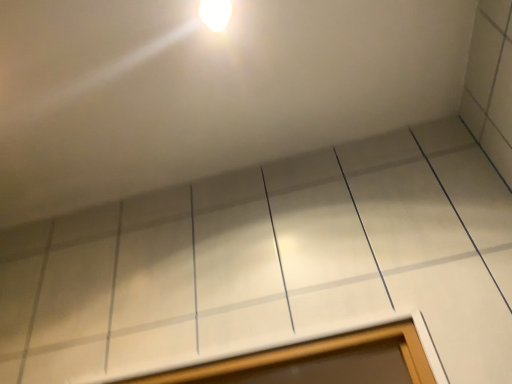
Locate an element on the screen. white glossy light fixture at upper center is located at coordinates (215, 13).

What do you see at coordinates (215, 13) in the screenshot? This screenshot has width=512, height=384. I see `white glossy light fixture at upper center` at bounding box center [215, 13].

Measure the distance between white glossy window at lower center and camera.

The depth of white glossy window at lower center is 36.57 inches.

Identify the location of white glossy window at lower center. Image resolution: width=512 pixels, height=384 pixels. pos(304,356).

This screenshot has width=512, height=384. What do you see at coordinates (304, 356) in the screenshot? I see `white glossy window at lower center` at bounding box center [304, 356].

The height and width of the screenshot is (384, 512). Find the location of `white glossy light fixture at upper center`. white glossy light fixture at upper center is located at coordinates (215, 13).

Looking at this image, is white glossy light fixture at upper center to the right of white glossy window at lower center from the viewer's perspective?

No, white glossy light fixture at upper center is not to the right of white glossy window at lower center.

Relative to white glossy window at lower center, is white glossy light fixture at upper center in front or behind?

white glossy light fixture at upper center is behind white glossy window at lower center.

Is point (224, 6) farther from viewer compared to point (206, 380)?

No, (224, 6) is in front of (206, 380).

From the image's perspective, is white glossy light fixture at upper center under white glossy window at lower center?

Actually, white glossy light fixture at upper center appears above white glossy window at lower center in the image.

From a real-world perspective, who is located lower, white glossy light fixture at upper center or white glossy window at lower center?

In real-world perspective, white glossy window at lower center is lower.

Which of these two, white glossy light fixture at upper center or white glossy window at lower center, is wider?

white glossy light fixture at upper center.

From their relative heights in the image, would you say white glossy light fixture at upper center is taller or shorter than white glossy window at lower center?

In the image, white glossy light fixture at upper center appears to be shorter than white glossy window at lower center.

Between white glossy light fixture at upper center and white glossy window at lower center, which one has larger size?

Bigger between the two is white glossy window at lower center.

Is white glossy light fixture at upper center not inside white glossy window at lower center?

Yes, white glossy light fixture at upper center is outside of white glossy window at lower center.

Are white glossy light fixture at upper center and white glossy window at lower center making contact?

white glossy light fixture at upper center is not next to white glossy window at lower center, and they're not touching.

Is white glossy light fixture at upper center aimed at white glossy window at lower center?

No, white glossy light fixture at upper center does not turn towards white glossy window at lower center.

Can you tell me how much white glossy light fixture at upper center and white glossy window at lower center differ in facing direction?

The facing directions of white glossy light fixture at upper center and white glossy window at lower center are 88.7 degrees apart.

How much distance is there between white glossy light fixture at upper center and white glossy window at lower center?

The distance of white glossy light fixture at upper center from white glossy window at lower center is 33.59 inches.

In order to click on window on the right of white glossy light fixture at upper center in this screenshot , I will do `click(304, 356)`.

Which is more to the left, white glossy window at lower center or white glossy light fixture at upper center?

white glossy light fixture at upper center is more to the left.

Considering the positions of objects white glossy window at lower center and white glossy light fixture at upper center in the image provided, who is behind, white glossy window at lower center or white glossy light fixture at upper center?

white glossy light fixture at upper center is more distant.

Considering the points (254, 354) and (219, 0), which point is in front, point (254, 354) or point (219, 0)?

The point (219, 0) is closer to the camera.

From the image's perspective, which is above, white glossy window at lower center or white glossy light fixture at upper center?

white glossy light fixture at upper center, from the image's perspective.

In the scene shown: From a real-world perspective, does white glossy window at lower center stand above white glossy light fixture at upper center?

Actually, white glossy window at lower center is physically below white glossy light fixture at upper center in the real world.

Considering the sizes of objects white glossy window at lower center and white glossy light fixture at upper center in the image provided, who is wider, white glossy window at lower center or white glossy light fixture at upper center?

white glossy light fixture at upper center.

Does white glossy window at lower center have a greater height compared to white glossy light fixture at upper center?

Yes, white glossy window at lower center is taller than white glossy light fixture at upper center.

Can you confirm if white glossy window at lower center is smaller than white glossy light fixture at upper center?

No.

Is white glossy light fixture at upper center inside white glossy window at lower center?

No, white glossy light fixture at upper center is not surrounded by white glossy window at lower center.

Would you say white glossy window at lower center is a long distance from white glossy light fixture at upper center?

white glossy window at lower center is actually quite close to white glossy light fixture at upper center.

Could you tell me if white glossy window at lower center is turned towards white glossy light fixture at upper center?

No, white glossy window at lower center is not turned towards white glossy light fixture at upper center.

Where is `window below the white glossy light fixture at upper center (from a real-world perspective)`? Image resolution: width=512 pixels, height=384 pixels. window below the white glossy light fixture at upper center (from a real-world perspective) is located at coordinates (304, 356).

Where is `light fixture on the left of white glossy window at lower center`? The image size is (512, 384). light fixture on the left of white glossy window at lower center is located at coordinates (215, 13).

You are a GUI agent. You are given a task and a screenshot of the screen. Output one action in this format:
    pyautogui.click(x=<x>, y=<y>)
    Task: Click on the light fixture that is above the white glossy window at lower center (from the image's perspective)
    The width and height of the screenshot is (512, 384).
    Given the screenshot: What is the action you would take?
    pyautogui.click(x=215, y=13)